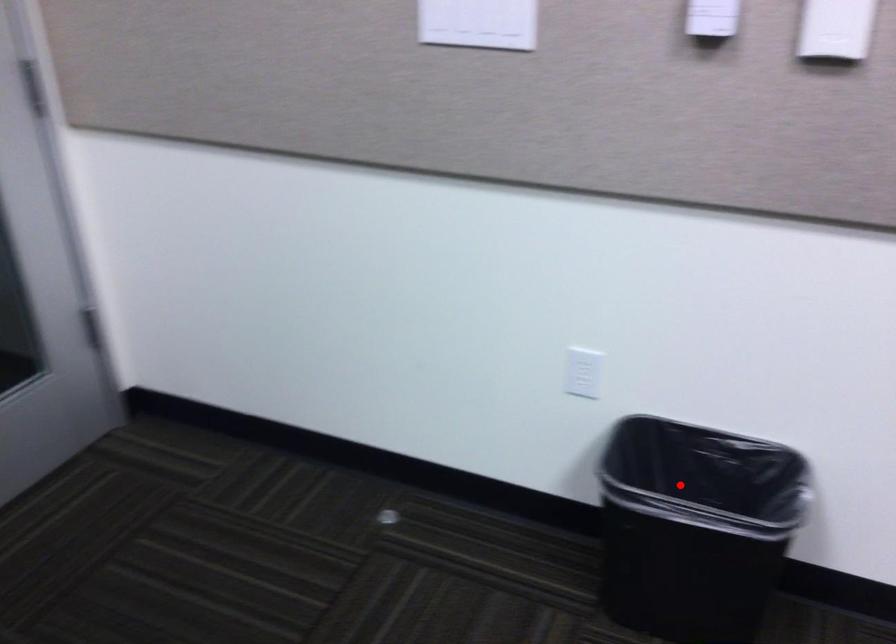
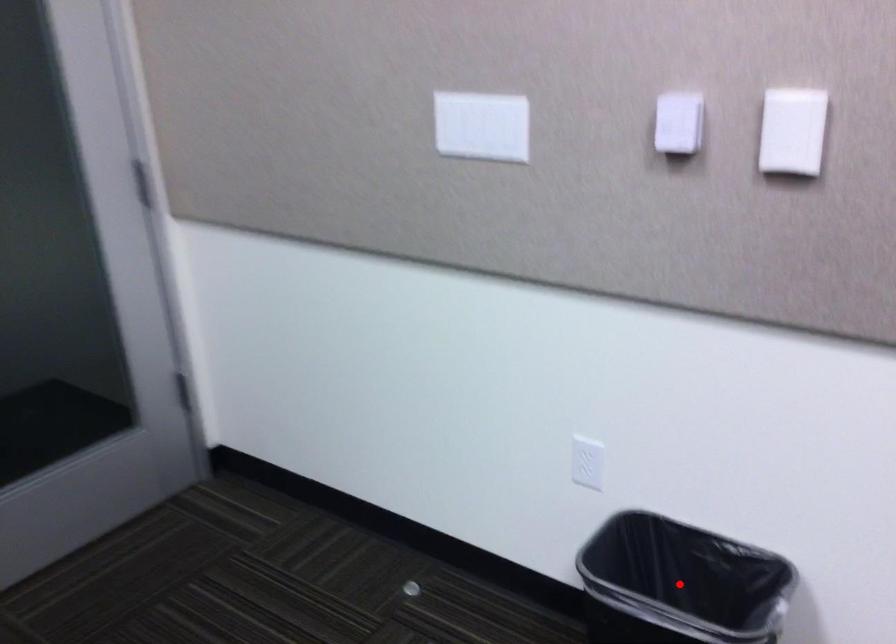
I am providing you with two images of the same scene from different viewpoints. A red point is marked on the first image and another point is marked on the second image. Are the points marked in image1 and image2 representing the same 3D position?

Yes